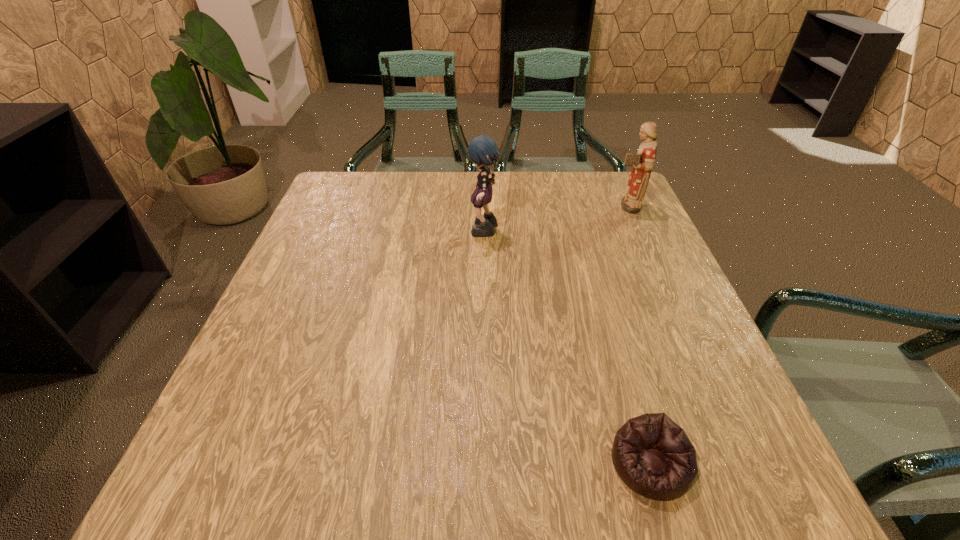
What are the coordinates of `free space between the beanbag and the rag doll` in the screenshot? It's located at (567, 348).

Where is `free space between the rag doll and the rightmost object`? The image size is (960, 540). free space between the rag doll and the rightmost object is located at coordinates (555, 219).

Where is `free space between the rag doll and the beanbag`? The width and height of the screenshot is (960, 540). free space between the rag doll and the beanbag is located at coordinates (567, 348).

The height and width of the screenshot is (540, 960). What are the coordinates of `vacant area between the leftmost object and the second object from left to right` in the screenshot? It's located at (567, 348).

Identify which object is the nearest to the rightmost object. Please provide its 2D coordinates. Your answer should be formatted as a tuple, i.e. [(x, y)], where the tuple contains the x and y coordinates of a point satisfying the conditions above.

[(482, 150)]

Find the location of a particular element. This screenshot has width=960, height=540. the closest object to the rag doll is located at coordinates click(x=643, y=161).

You are a GUI agent. You are given a task and a screenshot of the screen. Output one action in this format:
    pyautogui.click(x=<x>, y=<y>)
    Task: Click on the vacant space that satisfies the following two spatial constraints: 1. on the front-facing side of the figurine; 2. on the front side of the nearest object
    The height and width of the screenshot is (540, 960).
    Given the screenshot: What is the action you would take?
    pyautogui.click(x=739, y=463)

This screenshot has width=960, height=540. I want to click on blank space that satisfies the following two spatial constraints: 1. on the front-facing side of the leftmost object; 2. on the back side of the nearest object, so click(488, 463).

Image resolution: width=960 pixels, height=540 pixels. Identify the location of free space that satisfies the following two spatial constraints: 1. on the front-facing side of the second nearest object; 2. on the right side of the second object from right to left. 488,463.

Locate an element on the screen. vacant space that satisfies the following two spatial constraints: 1. on the front-facing side of the farthest object; 2. on the front side of the beanbag is located at coordinates (739, 463).